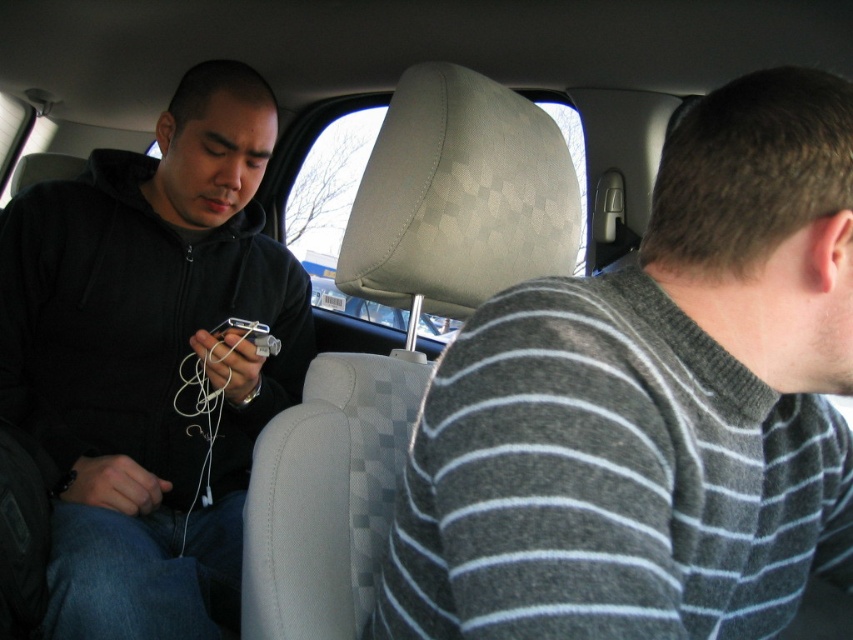
You are a passenger in the car and want to hand your friend the gray striped sweater at right. Since you are sitting on the black matte hoodie at left, which side should you reach towards to give them the sweater?

The gray striped sweater at right is to the right of the black matte hoodie at left, so you should reach towards your right side to give them the sweater.

You are a tailor who needs to determine which garment requires more fabric for a custom order. Based on the image, which of the two garments, the gray striped sweater at right or the black matte hoodie at left, would require more fabric?

The black matte hoodie at left would require more fabric since its width is greater than the gray striped sweater at right.

You are a tailor who needs to adjust the sleeves of both the gray striped sweater at right and the black matte hoodie at left. Based on the size difference mentioned, which garment might require shorter sleeves to accommodate the wearer?

The gray striped sweater at right has a smaller size compared to the black matte hoodie at left, so the gray striped sweater at right might require shorter sleeves to accommodate the wearer.